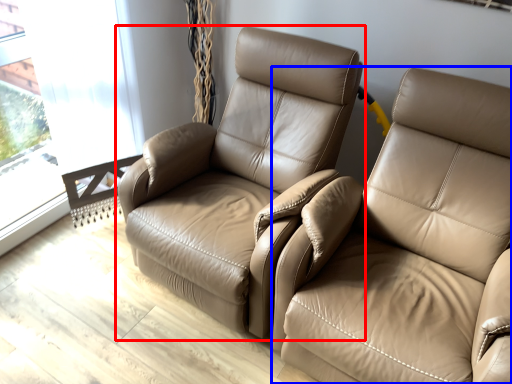
Question: Which object appears closest to the camera in this image, chair (highlighted by a red box) or studio couch (highlighted by a blue box)?

Choices:
 (A) chair
 (B) studio couch

Answer: (B)